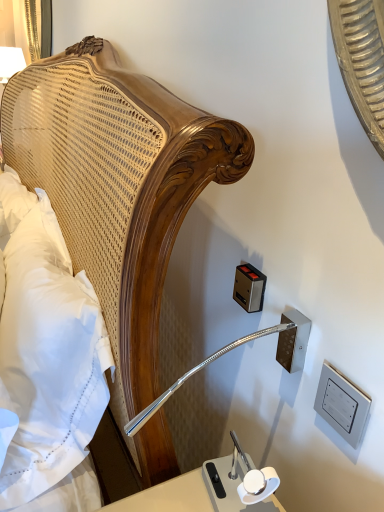
Question: Is white soft pillow at left inside or outside of metallic rectangular outlet at upper right, arranged as the 1th electric outlet when viewed from the left?

Choices:
 (A) inside
 (B) outside

Answer: (B)

Question: Is white soft pillow at left wider or thinner than metallic rectangular outlet at upper right, which ranks as the 2th electric outlet in right-to-left order?

Choices:
 (A) thin
 (B) wide

Answer: (B)

Question: Which object is the closest to the metallic rectangular outlet at upper right, the 1th electric outlet in the back-to-front sequence?

Choices:
 (A) white soft pillow at left
 (B) metallic silver outlet at lower right, positioned as the first electric outlet in front-to-back order

Answer: (B)

Question: Considering the real-world distances, which object is farthest from the metallic silver outlet at lower right, positioned as the first electric outlet in right-to-left order?

Choices:
 (A) white soft pillow at left
 (B) metallic rectangular outlet at upper right, arranged as the 1th electric outlet when viewed from the left

Answer: (A)